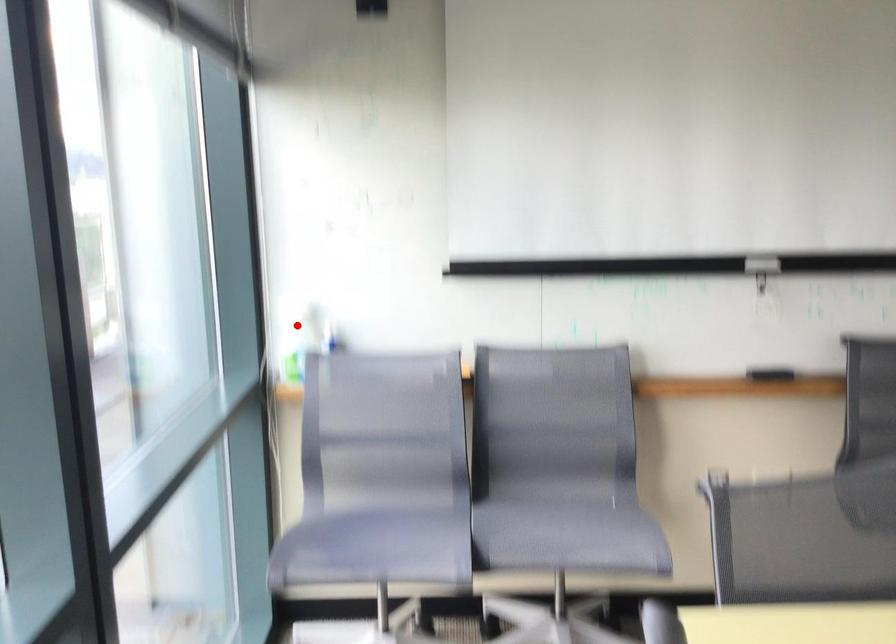
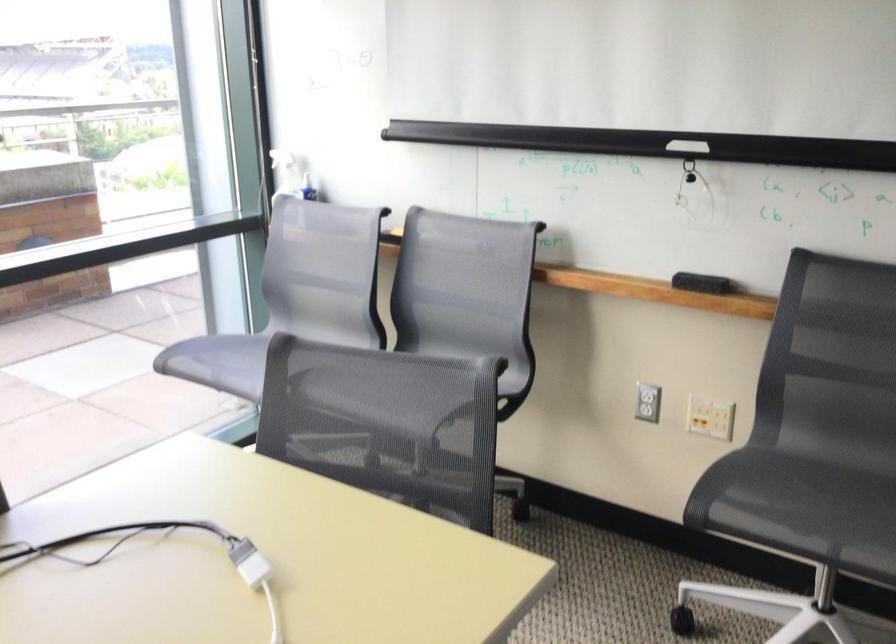
In the second image, find the point that corresponds to the highlighted location in the first image.

(287, 174)